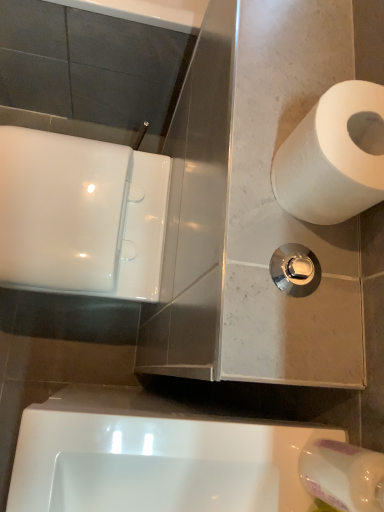
Question: Does white matte toilet paper at upper right, the first toilet paper positioned from the bottom, have a larger size compared to white paper at right, placed as the second toilet paper when sorted from bottom to top?

Choices:
 (A) yes
 (B) no

Answer: (B)

Question: Is white matte toilet paper at upper right, the first toilet paper positioned from the bottom, oriented towards white paper at right, the 1th toilet paper when ordered from top to bottom?

Choices:
 (A) yes
 (B) no

Answer: (B)

Question: Considering the relative positions of white matte toilet paper at upper right, the first toilet paper positioned from the bottom, and white paper at right, the 1th toilet paper when ordered from top to bottom, in the image provided, is white matte toilet paper at upper right, the first toilet paper positioned from the bottom, to the right of white paper at right, the 1th toilet paper when ordered from top to bottom, from the viewer's perspective?

Choices:
 (A) yes
 (B) no

Answer: (B)

Question: Can we say white matte toilet paper at upper right, the second toilet paper in the top-to-bottom sequence, lies outside white paper at right, placed as the second toilet paper when sorted from bottom to top?

Choices:
 (A) yes
 (B) no

Answer: (A)

Question: Can you confirm if white matte toilet paper at upper right, the second toilet paper in the top-to-bottom sequence, is smaller than white paper at right, placed as the second toilet paper when sorted from bottom to top?

Choices:
 (A) no
 (B) yes

Answer: (B)

Question: From the image's perspective, does white matte toilet paper at upper right, the second toilet paper in the top-to-bottom sequence, appear higher than white paper at right, the 1th toilet paper when ordered from top to bottom?

Choices:
 (A) no
 (B) yes

Answer: (A)

Question: Can you confirm if polished chrome flush handle at center-right is shorter than white glossy urinal at lower center?

Choices:
 (A) no
 (B) yes

Answer: (B)

Question: Is polished chrome flush handle at center-right with white glossy urinal at lower center?

Choices:
 (A) no
 (B) yes

Answer: (A)

Question: From a real-world perspective, does polished chrome flush handle at center-right stand above white glossy urinal at lower center?

Choices:
 (A) no
 (B) yes

Answer: (B)

Question: Is polished chrome flush handle at center-right at the right side of white glossy urinal at lower center?

Choices:
 (A) yes
 (B) no

Answer: (A)

Question: Is white glossy urinal at lower center a part of polished chrome flush handle at center-right?

Choices:
 (A) no
 (B) yes

Answer: (A)

Question: Could you tell me if polished chrome flush handle at center-right is turned towards white glossy urinal at lower center?

Choices:
 (A) yes
 (B) no

Answer: (B)

Question: From a real-world perspective, does white matte toilet paper at upper right, the first toilet paper positioned from the bottom, sit lower than white glossy urinal at lower center?

Choices:
 (A) no
 (B) yes

Answer: (A)